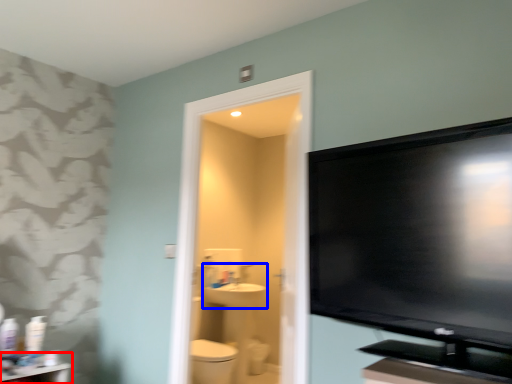
Question: Among these objects, which one is nearest to the camera, table (highlighted by a red box) or sink (highlighted by a blue box)?

Choices:
 (A) table
 (B) sink

Answer: (A)